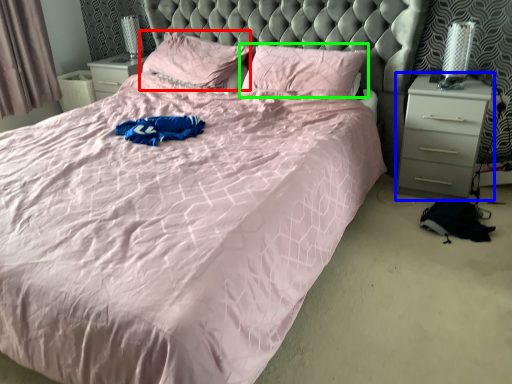
Question: Which object is the closest to the pillow (highlighted by a red box)? Choose among these: nightstand (highlighted by a blue box) or pillow (highlighted by a green box).

Choices:
 (A) nightstand
 (B) pillow

Answer: (B)